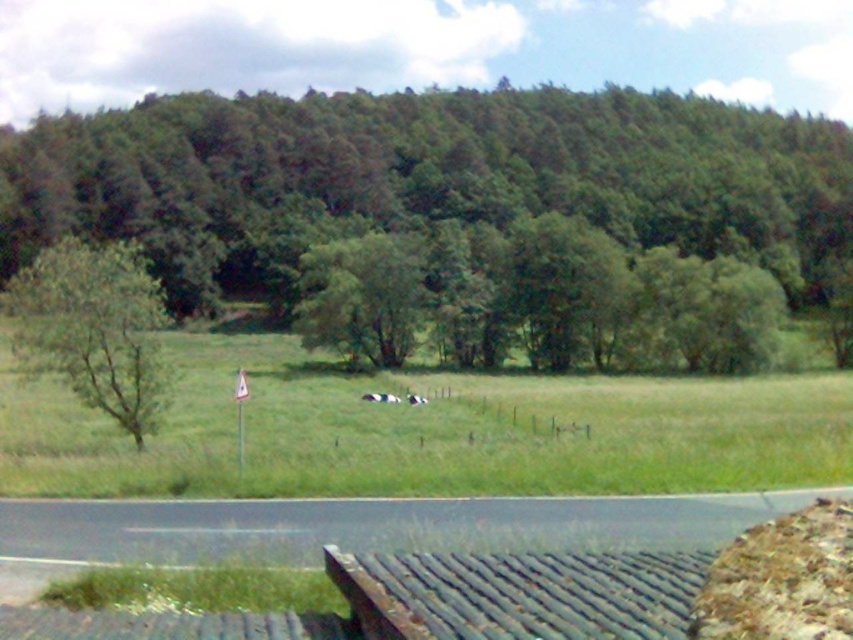
Question: Is green leafy tree at left thinner than green leafy tree at center?

Choices:
 (A) no
 (B) yes

Answer: (A)

Question: Which point is closer to the camera?

Choices:
 (A) (567, 100)
 (B) (299, 435)
 (C) (335, 259)

Answer: (B)

Question: Which of the following is the farthest from the observer?

Choices:
 (A) (225, 100)
 (B) (392, 403)
 (C) (236, 349)
 (D) (413, 403)

Answer: (A)

Question: Estimate the real-world distances between objects in this image. Which object is farther from the white fur at center?

Choices:
 (A) rusty metal bench at lower center
 (B) white fluffy sheep at center

Answer: (A)

Question: Is white fur at center further to camera compared to white fluffy sheep at center?

Choices:
 (A) yes
 (B) no

Answer: (A)

Question: Does rusty metal bench at lower center have a larger size compared to green leafy tree at center?

Choices:
 (A) yes
 (B) no

Answer: (B)